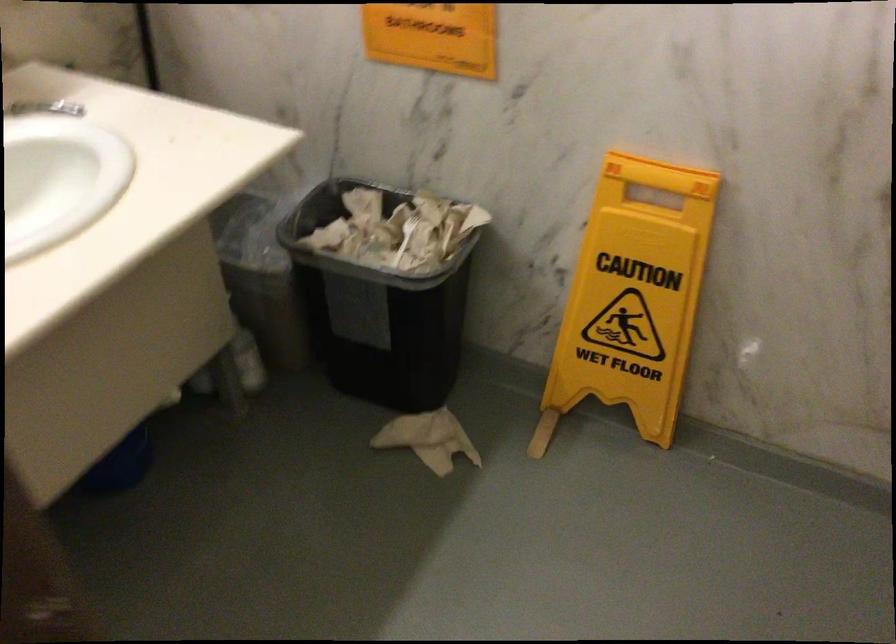
Describe the element at coordinates (45, 108) in the screenshot. I see `the metal faucet handle` at that location.